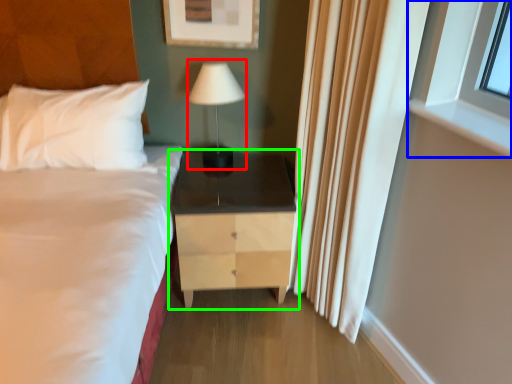
Question: Considering the real-world distances, which object is farthest from table lamp (highlighted by a red box)? window (highlighted by a blue box) or nightstand (highlighted by a green box)?

Choices:
 (A) window
 (B) nightstand

Answer: (A)